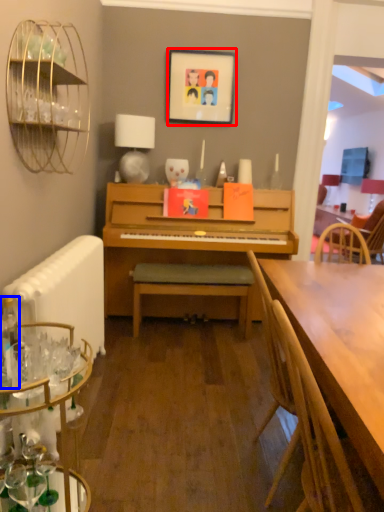
Question: Which of the following is the farthest to the observer, picture frame (highlighted by a red box) or bottle (highlighted by a blue box)?

Choices:
 (A) picture frame
 (B) bottle

Answer: (A)